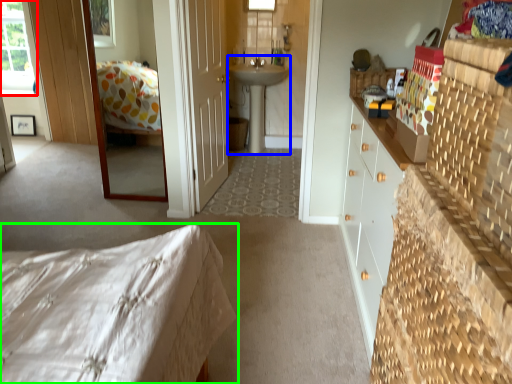
Question: Which is farther away from window (highlighted by a red box)? sink (highlighted by a blue box) or bed (highlighted by a green box)?

Choices:
 (A) sink
 (B) bed

Answer: (B)